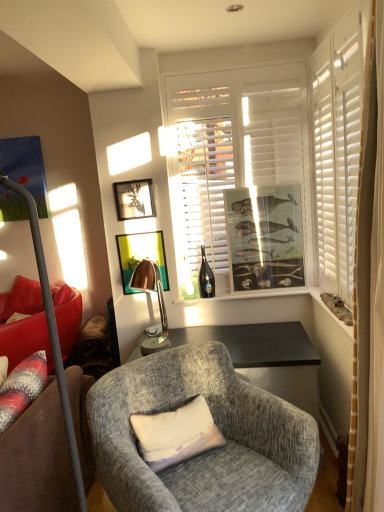
Question: Is white textured stone at right, which is counted as the 2th window sill, starting from the left, far away from copper metallic lamp at center, positioned as the second lamp in front-to-back order?

Choices:
 (A) yes
 (B) no

Answer: (A)

Question: Is the position of white textured stone at right, which is counted as the 2th window sill, starting from the left, less distant than that of copper metallic lamp at center, positioned as the second lamp in front-to-back order?

Choices:
 (A) yes
 (B) no

Answer: (A)

Question: Is copper metallic lamp at center, the 1th lamp positioned from the back, a part of white textured stone at right, which ranks as the 1th window sill in front-to-back order?

Choices:
 (A) no
 (B) yes

Answer: (A)

Question: Is white textured stone at right, the second window sill when ordered from back to front, placed right next to copper metallic lamp at center, the 1th lamp positioned from the back?

Choices:
 (A) yes
 (B) no

Answer: (B)

Question: Considering the relative positions of white textured stone at right, which ranks as the 1th window sill in front-to-back order, and copper metallic lamp at center, the second lamp when ordered from left to right, in the image provided, is white textured stone at right, which ranks as the 1th window sill in front-to-back order, to the left of copper metallic lamp at center, the second lamp when ordered from left to right, from the viewer's perspective?

Choices:
 (A) no
 (B) yes

Answer: (A)

Question: Is white textured stone at right, which ranks as the 1th window sill in front-to-back order, behind copper metallic lamp at center, the second lamp when ordered from left to right?

Choices:
 (A) no
 (B) yes

Answer: (A)

Question: Can we say copper metallic lamp at center, the second lamp when ordered from left to right, lies outside pastel fabric pillow at center?

Choices:
 (A) no
 (B) yes

Answer: (B)

Question: Does copper metallic lamp at center, the 1th lamp positioned from the back, have a greater width compared to pastel fabric pillow at center?

Choices:
 (A) yes
 (B) no

Answer: (A)

Question: Could you tell me if copper metallic lamp at center, the second lamp when ordered from left to right, is turned towards pastel fabric pillow at center?

Choices:
 (A) yes
 (B) no

Answer: (A)

Question: Does copper metallic lamp at center, the 1th lamp positioned from the back, appear on the left side of pastel fabric pillow at center?

Choices:
 (A) yes
 (B) no

Answer: (A)

Question: Is copper metallic lamp at center, the second lamp when ordered from left to right, shorter than pastel fabric pillow at center?

Choices:
 (A) no
 (B) yes

Answer: (A)

Question: From the image's perspective, does copper metallic lamp at center, the second lamp when ordered from left to right, appear lower than pastel fabric pillow at center?

Choices:
 (A) no
 (B) yes

Answer: (A)

Question: Considering the relative positions of pastel fabric pillow at center and matte glass window sill at center, the 2th window sill from the right, in the image provided, is pastel fabric pillow at center in front of matte glass window sill at center, the 2th window sill from the right,?

Choices:
 (A) no
 (B) yes

Answer: (B)